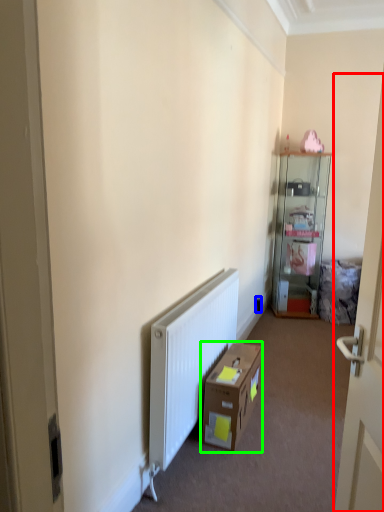
Question: Which is farther away from door (highlighted by a red box)? electric outlet (highlighted by a blue box) or cardboard box (highlighted by a green box)?

Choices:
 (A) electric outlet
 (B) cardboard box

Answer: (A)